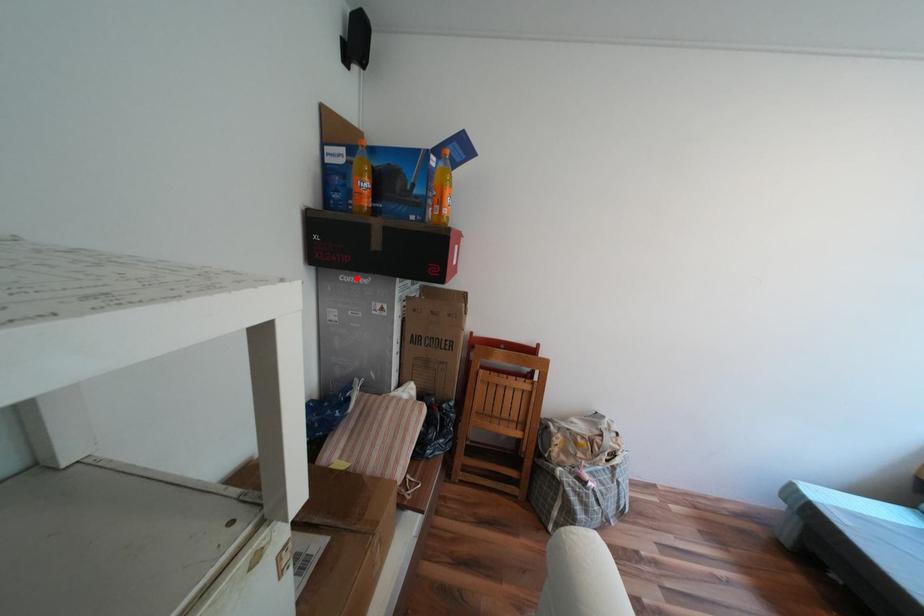
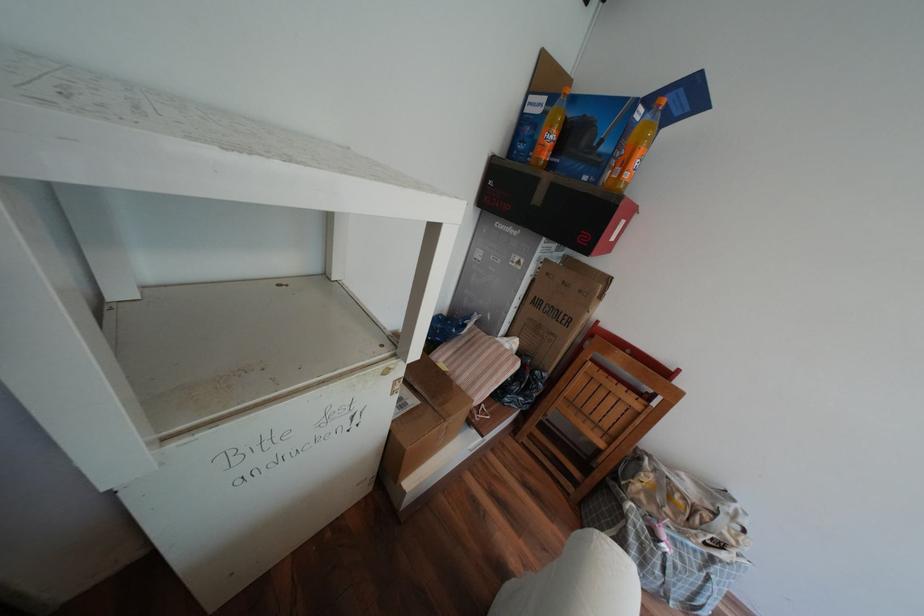
Locate, in the second image, the point that corresponds to the highlighted location in the first image.

(511, 225)